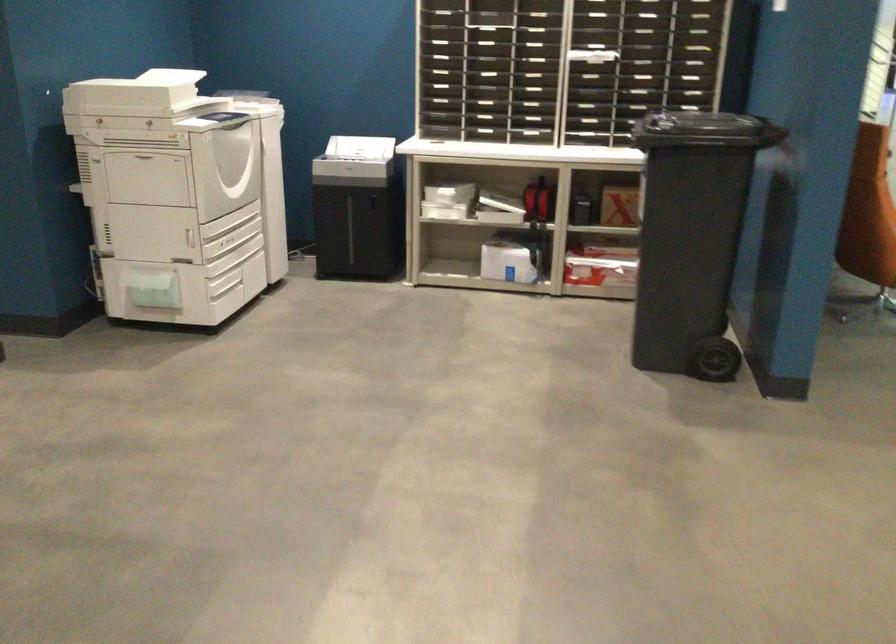
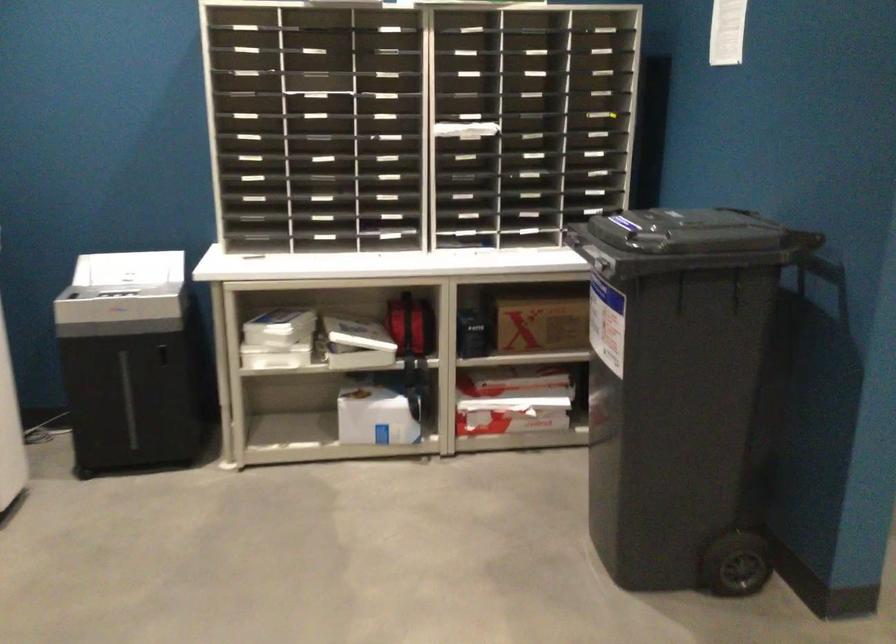
Question: What movement of the cameraman would produce the second image?

Choices:
 (A) Left
 (B) Right
 (C) Forward
 (D) Backward

Answer: (C)